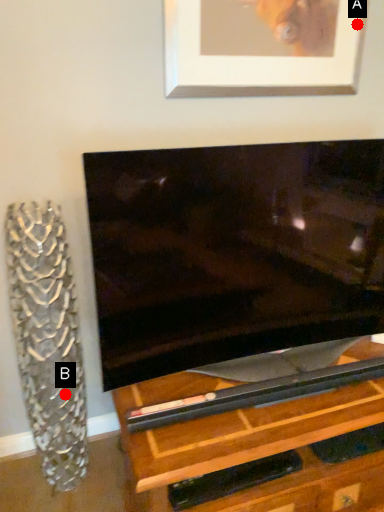
Question: Two points are circled on the image, labeled by A and B beside each circle. Which of the following is the closest to the observer?

Choices:
 (A) A is closer
 (B) B is closer

Answer: (B)